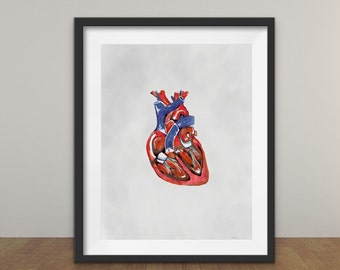
The height and width of the screenshot is (270, 340). I want to click on frame, so click(x=270, y=82), click(x=76, y=110).